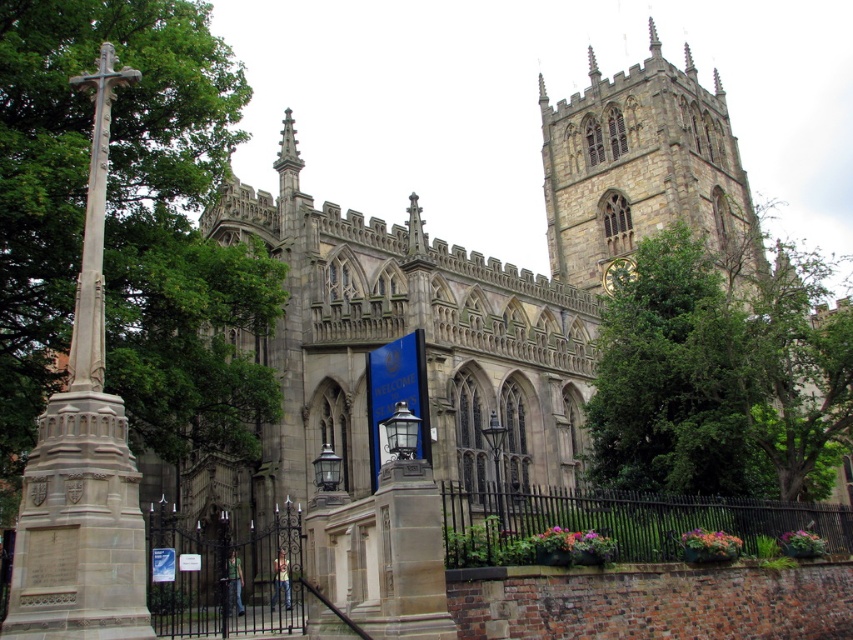
Measure the distance from stone church at center to gold metallic clock at upper right.

stone church at center and gold metallic clock at upper right are 19.68 meters apart.

Who is more distant from viewer, (x=622, y=227) or (x=618, y=272)?

Positioned behind is point (x=622, y=227).

Where is `stone church at center`? The image size is (853, 640). stone church at center is located at coordinates (473, 291).

Does green leafy tree at center have a lesser height compared to gold metallic clock at upper right?

Incorrect, green leafy tree at center's height does not fall short of gold metallic clock at upper right's.

Can you confirm if green leafy tree at center is positioned to the left of gold metallic clock at upper right?

No, green leafy tree at center is not to the left of gold metallic clock at upper right.

Identify the location of green leafy tree at center. (674, 380).

Is point (68, 625) closer to viewer compared to point (618, 202)?

Yes, point (68, 625) is closer to viewer.

Which is above, polished stone cross at left or stone clock tower at upper center?

Positioned higher is stone clock tower at upper center.

Does point (71, 392) lie in front of point (598, 129)?

Yes, it is in front of point (598, 129).

You are a GUI agent. You are given a task and a screenshot of the screen. Output one action in this format:
    pyautogui.click(x=<x>, y=<y>)
    Task: Click on the polished stone cross at left
    This screenshot has height=640, width=853.
    Given the screenshot: What is the action you would take?
    pyautogui.click(x=82, y=460)